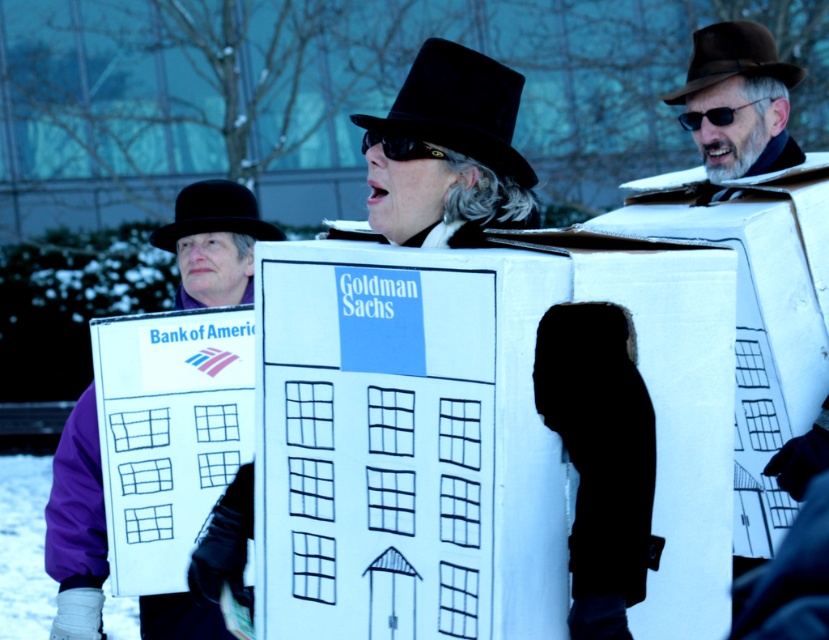
Question: In this image, where is black felt dress hat at center located relative to black plastic sunglasses at center?

Choices:
 (A) right
 (B) left

Answer: (B)

Question: Does white cardboard sign at left have a smaller size compared to black felt hat at center?

Choices:
 (A) yes
 (B) no

Answer: (B)

Question: Estimate the real-world distances between objects in this image. Which object is closer to the black matte goggles at center?

Choices:
 (A) white cardboard at center
 (B) black felt hat at center

Answer: (B)

Question: Which object is the closest to the black plastic sunglasses at center?

Choices:
 (A) black felt hat at center
 (B) brown felt dress hat at upper right
 (C) white cardboard at center
 (D) black felt dress hat at center

Answer: (B)

Question: Which object is the closest to the black felt hat at center?

Choices:
 (A) black matte goggles at center
 (B) black felt dress hat at center
 (C) black plastic sunglasses at center
 (D) white cardboard at center

Answer: (C)

Question: Does brown felt dress hat at upper right come behind black matte goggles at center?

Choices:
 (A) no
 (B) yes

Answer: (A)